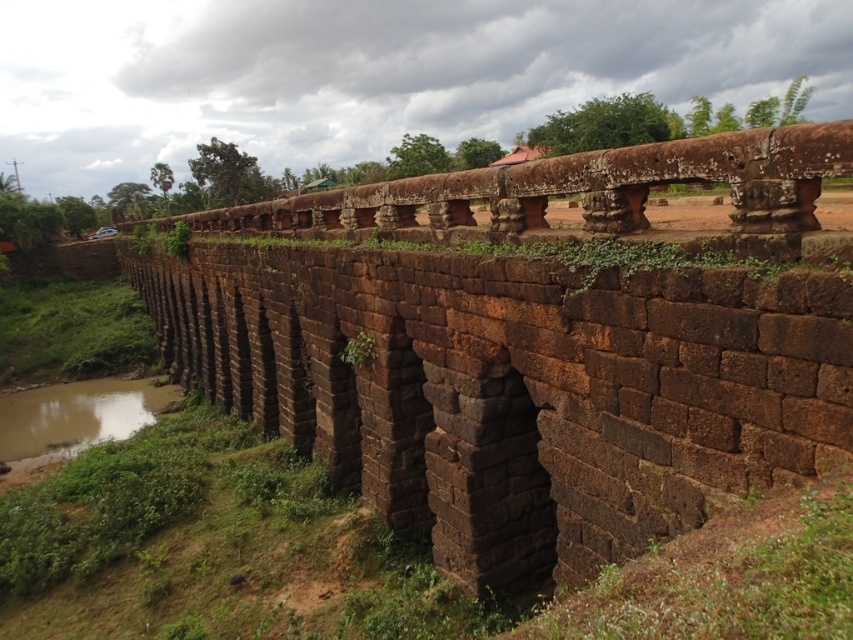
Question: Which point is closer to the camera?

Choices:
 (A) brown muddy water at lower left
 (B) brown stone bridge at center
 (C) brown stone viaduct at center

Answer: (C)

Question: Can you confirm if brown stone viaduct at center is positioned below brown stone bridge at center?

Choices:
 (A) no
 (B) yes

Answer: (B)

Question: Does brown stone viaduct at center appear on the left side of brown stone bridge at center?

Choices:
 (A) yes
 (B) no

Answer: (B)

Question: Which object appears farthest from the camera in this image?

Choices:
 (A) brown stone viaduct at center
 (B) brown muddy water at lower left

Answer: (B)

Question: Considering the real-world distances, which object is closest to the brown stone bridge at center?

Choices:
 (A) brown muddy water at lower left
 (B) brown stone viaduct at center

Answer: (B)

Question: Observing the image, what is the correct spatial positioning of brown stone viaduct at center in reference to brown stone bridge at center?

Choices:
 (A) above
 (B) below

Answer: (B)